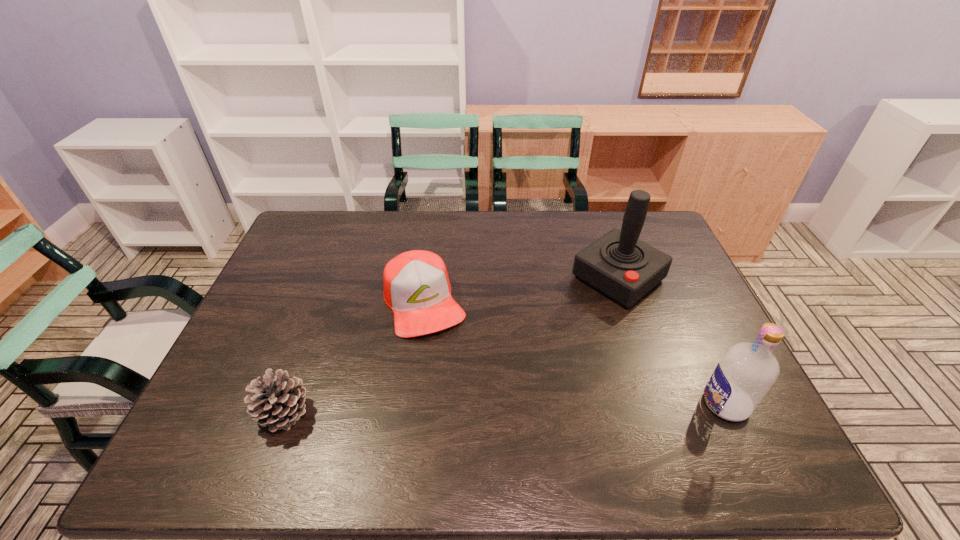
At what (x,y) coordinates should I click in order to perform the action: click on free spot that satisfies the following two spatial constraints: 1. on the back side of the joystick; 2. on the left side of the pinecone. Please return your answer as a coordinate pair (x, y). The width and height of the screenshot is (960, 540). Looking at the image, I should click on (333, 278).

Where is `blank area in the image that satisfies the following two spatial constraints: 1. on the back side of the second object from left to right; 2. on the left side of the joystick`? This screenshot has height=540, width=960. blank area in the image that satisfies the following two spatial constraints: 1. on the back side of the second object from left to right; 2. on the left side of the joystick is located at coordinates (427, 278).

Find the location of `free space that satisfies the following two spatial constraints: 1. on the back side of the pinecone; 2. on the label of the second tallest object`. free space that satisfies the following two spatial constraints: 1. on the back side of the pinecone; 2. on the label of the second tallest object is located at coordinates (287, 404).